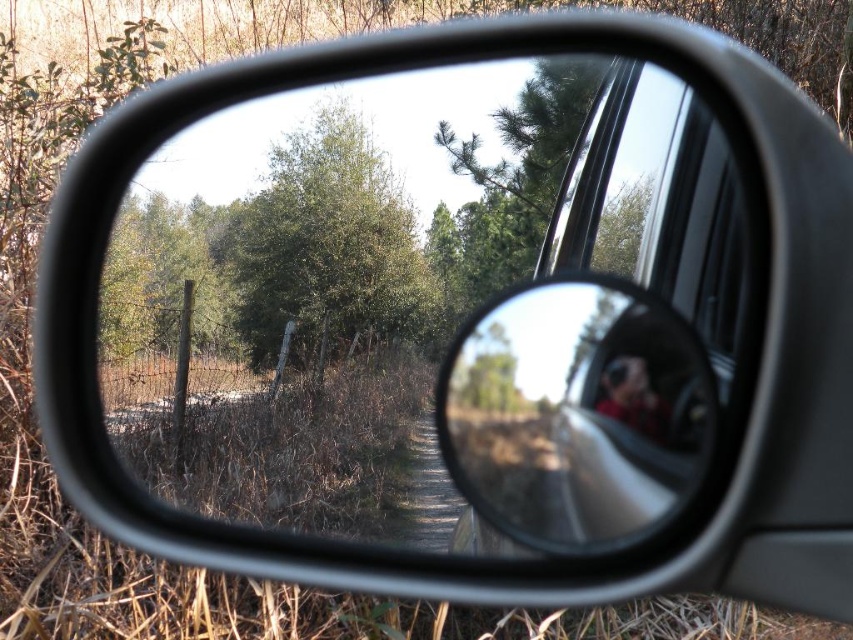
In the scene shown: You are a photographer trying to frame a shot using the vehicle side mirror. You notice the glossy metallic mirror at center and the blurred fabric person at center. Which object in your viewfinder is taller?

The glossy metallic mirror at center is taller than the blurred fabric person at center according to the reflection.

You are a photographer trying to capture the blurred fabric person at center and the green leafy tree at center in your shot. Based on their positions, which one is higher in the image?

The green leafy tree at center is located above the blurred fabric person at center, so it is higher in the image.